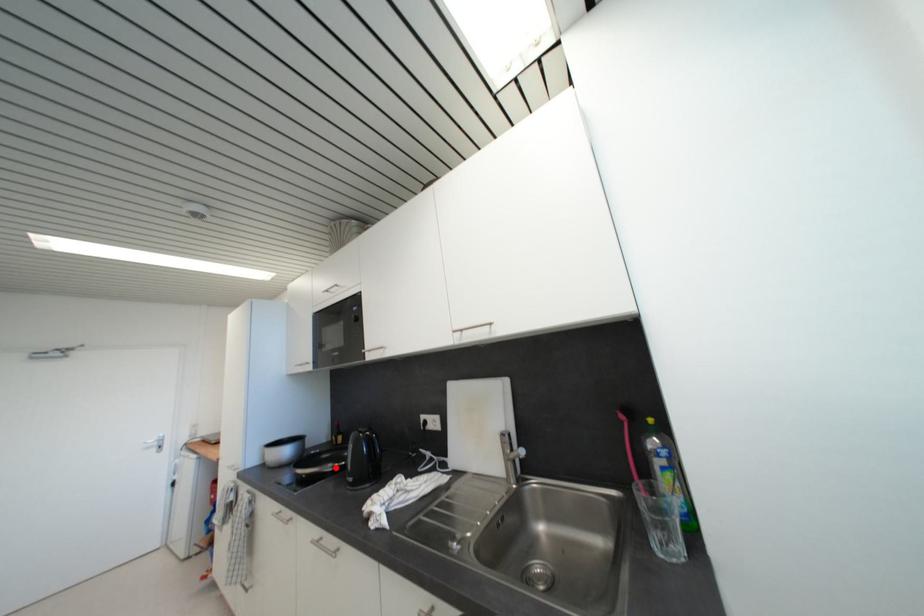
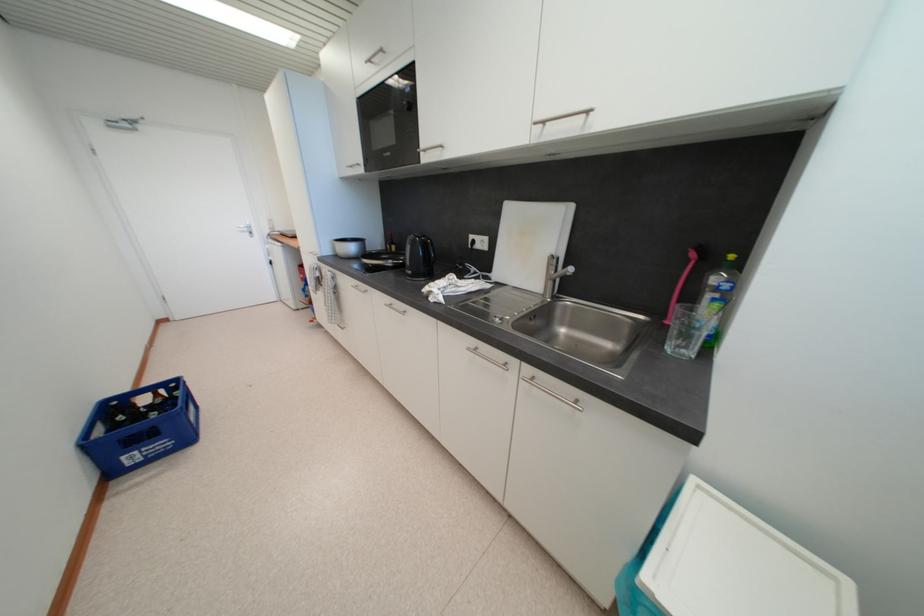
The point at the highlighted location is marked in the first image. Where is the corresponding point in the second image?

(395, 264)